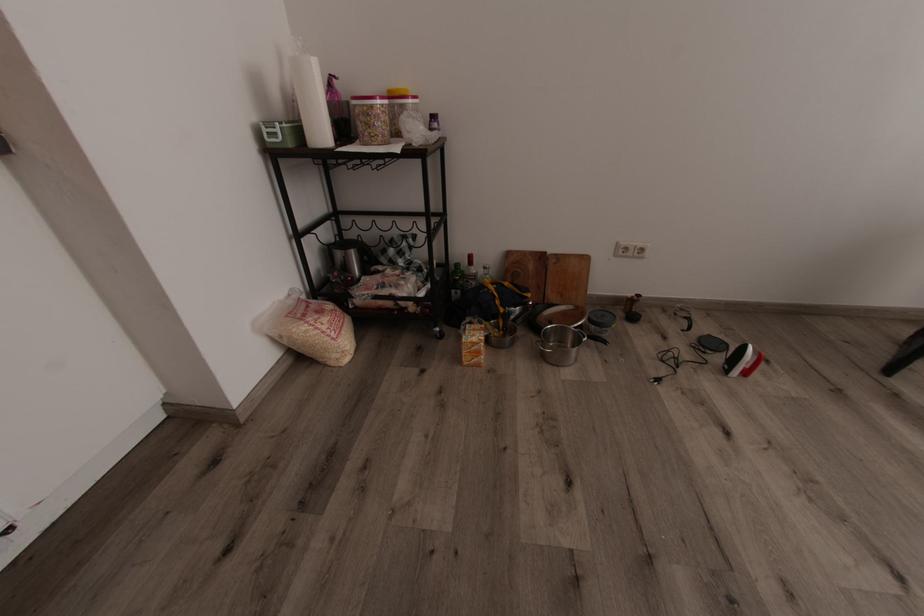
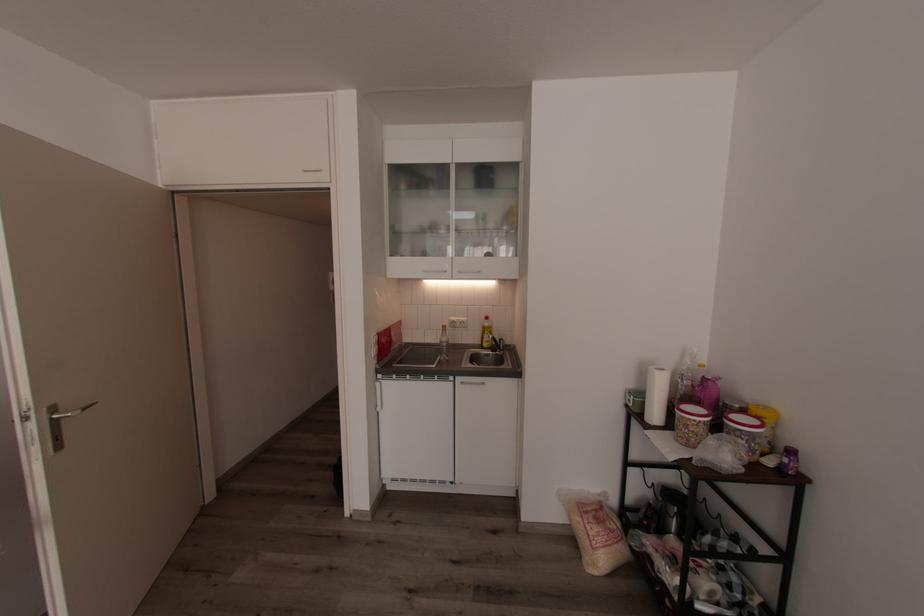
The point at (382, 116) is marked in the first image. Where is the corresponding point in the second image?

(690, 426)